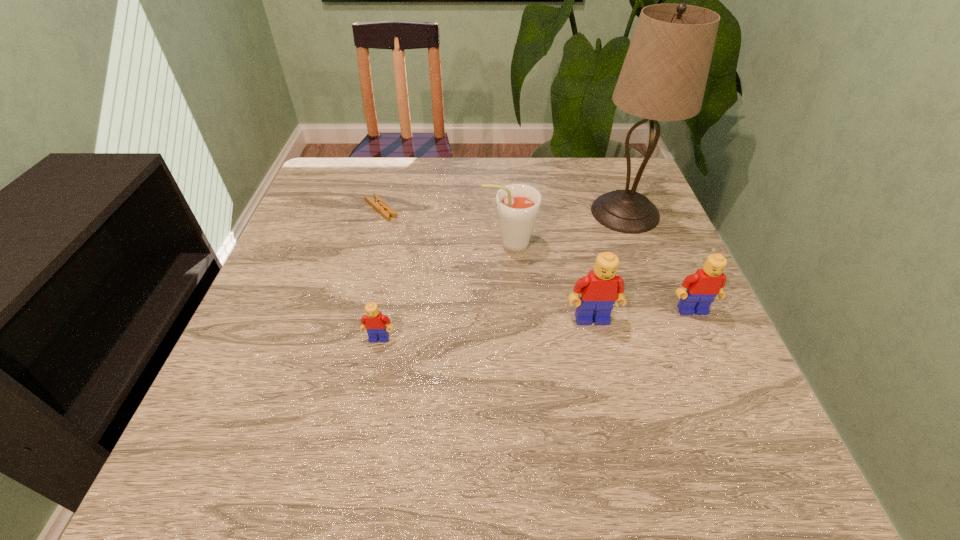
To achieve uniform spacing by inserting another Lego among them, please point to a free space for this new Lego. Please provide its 2D coordinates. Your answer should be formatted as a tuple, i.e. [(x, y)], where the tuple contains the x and y coordinates of a point satisfying the conditions above.

[(488, 329)]